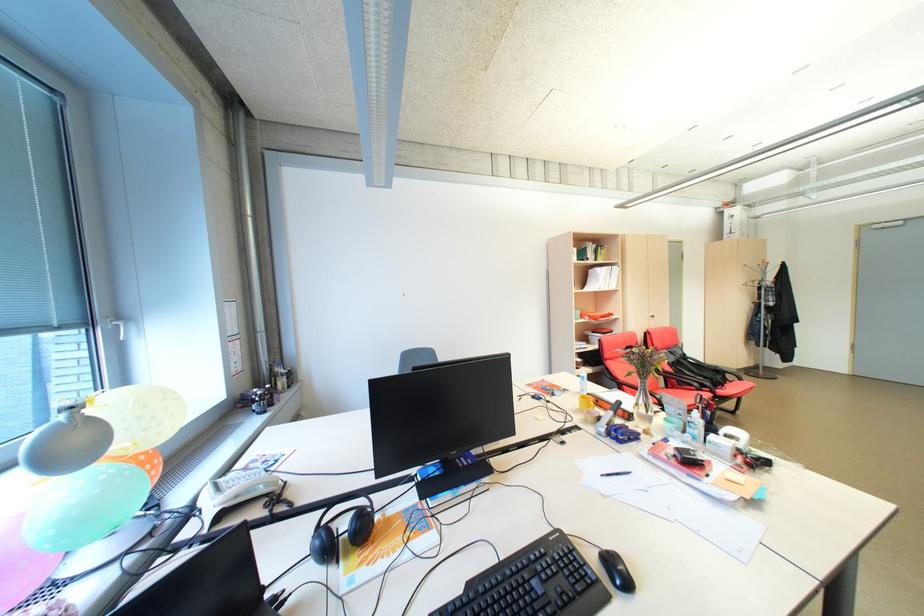
Describe the element at coordinates (119, 329) in the screenshot. The height and width of the screenshot is (616, 924). I see `the white window handle` at that location.